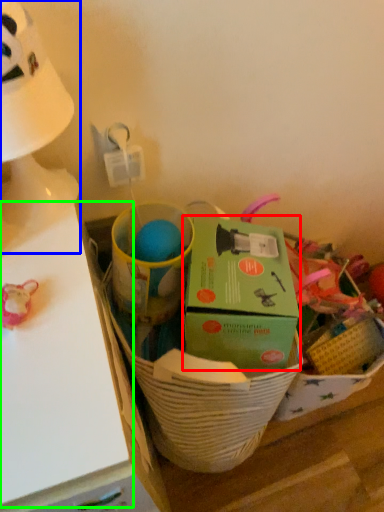
Question: Which is farther away from box (highlighted by a red box)? table lamp (highlighted by a blue box) or table (highlighted by a green box)?

Choices:
 (A) table lamp
 (B) table

Answer: (A)